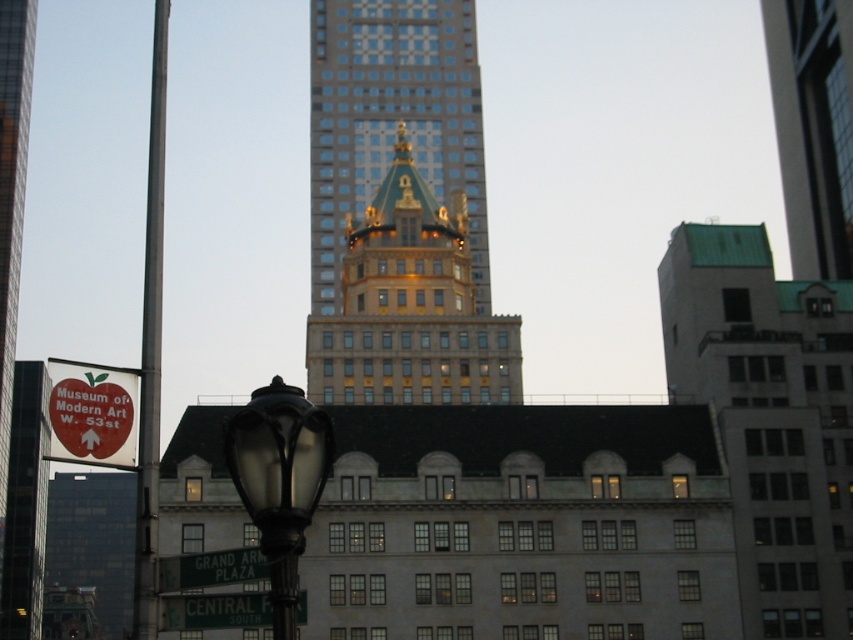
You are standing at the intersection and see the metallic glass skyscraper at upper right and the greensignboardstreet sign at lower center. Which object is located to the right of the other?

The metallic glass skyscraper at upper right is positioned on the right side of greensignboardstreet sign at lower center.

You are a tourist in New York City and you see the metallic glass skyscraper at upper right and the greensignboardstreet sign at lower center. Which one is higher in the image?

The metallic glass skyscraper at upper right is positioned over greensignboardstreet sign at lower center, so it is higher in the image.